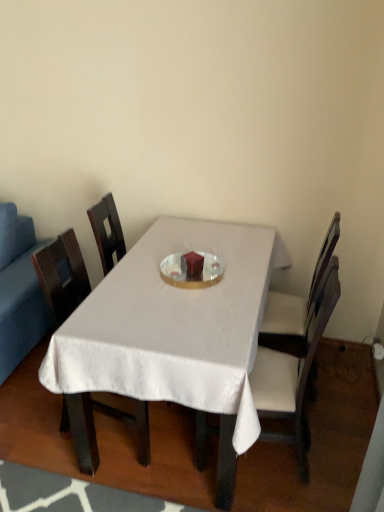
Image resolution: width=384 pixels, height=512 pixels. What are the coordinates of `empty space that is to the right of white fabric chair at center, the second chair from the right` in the screenshot? It's located at (332, 439).